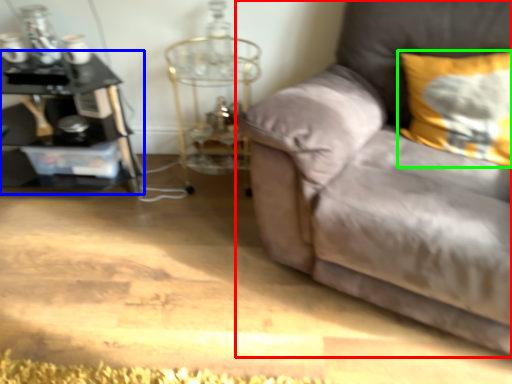
Question: Which object is positioned closest to studio couch (highlighted by a red box)? Select from table (highlighted by a blue box) and pillow (highlighted by a green box).

Choices:
 (A) table
 (B) pillow

Answer: (B)